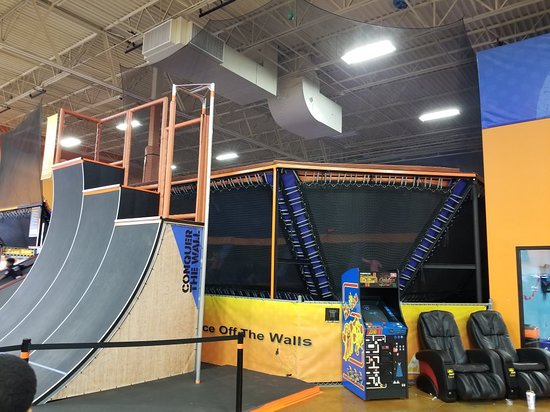
What are the coordinates of `orange wall` in the screenshot? It's located at (517, 198).